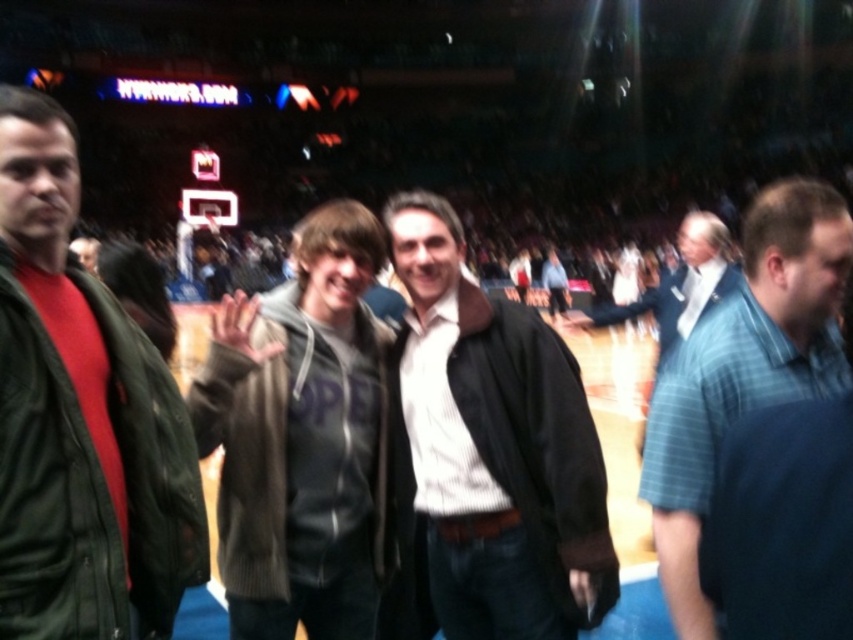
Question: Which object is positioned closest to the gray hoodie at center?

Choices:
 (A) blue plaid shirt at right
 (B) blue plaid suit at center
 (C) green leather jacket at left

Answer: (C)

Question: Which point is farther to the camera?

Choices:
 (A) matte black jacket at center
 (B) blue plaid suit at center
 (C) green leather jacket at left
 (D) blue plaid shirt at right

Answer: (B)

Question: Is gray hoodie at center below blue plaid shirt at right?

Choices:
 (A) yes
 (B) no

Answer: (A)

Question: Can you confirm if green leather jacket at left is positioned above blue plaid shirt at right?

Choices:
 (A) yes
 (B) no

Answer: (B)

Question: Which point is closer to the camera?

Choices:
 (A) (641, 305)
 (B) (340, 296)

Answer: (B)

Question: Is green leather jacket at left wider than gray hoodie at center?

Choices:
 (A) yes
 (B) no

Answer: (B)